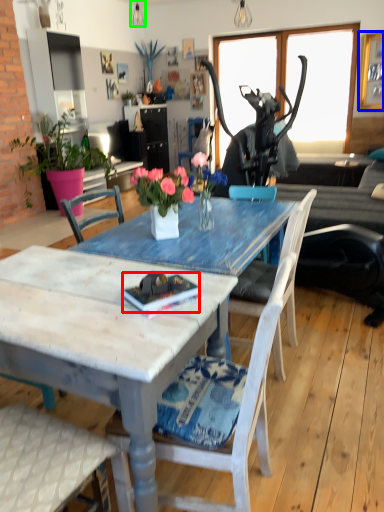
Question: Considering the real-world distances, which object is farthest from book (highlighted by a red box)? picture frame (highlighted by a blue box) or lamp (highlighted by a green box)?

Choices:
 (A) picture frame
 (B) lamp

Answer: (B)